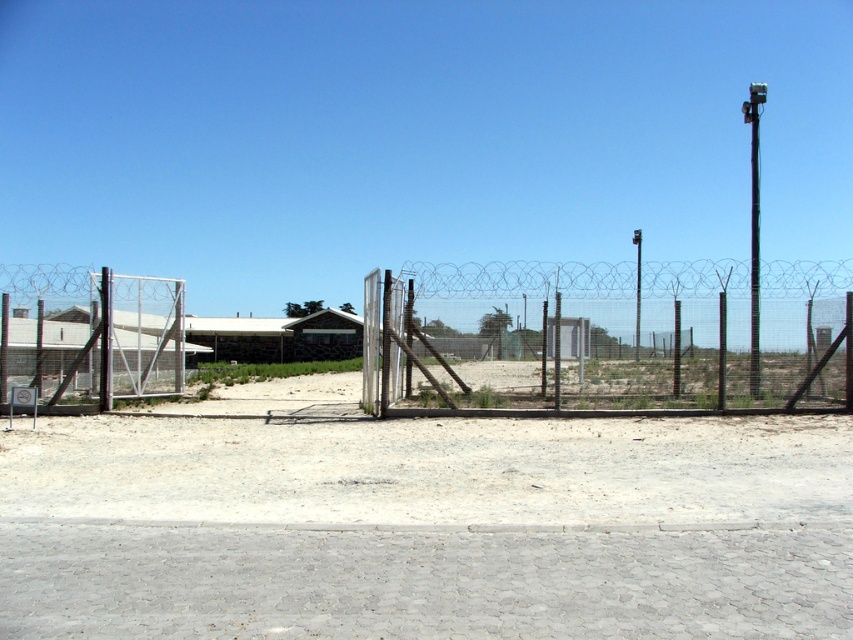
Question: Can you confirm if gray cobblestone dirt track at lower center is thinner than black wire mesh fence at center?

Choices:
 (A) no
 (B) yes

Answer: (B)

Question: Is gray cobblestone dirt track at lower center positioned before black wire mesh fence at center?

Choices:
 (A) no
 (B) yes

Answer: (B)

Question: Which point is closer to the camera taking this photo?

Choices:
 (A) (816, 477)
 (B) (177, 561)

Answer: (B)

Question: Which object appears closest to the camera in this image?

Choices:
 (A) metallic wire mesh fence at left
 (B) white sandy dirt at center
 (C) black wire mesh fence at center

Answer: (B)

Question: Does gray cobblestone dirt track at lower center appear over white sandy dirt at center?

Choices:
 (A) no
 (B) yes

Answer: (A)

Question: Which point appears closest to the camera in this image?

Choices:
 (A) (144, 472)
 (B) (55, 314)
 (C) (395, 349)

Answer: (A)